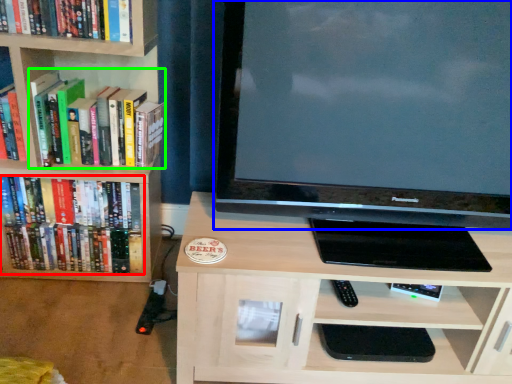
Question: Which object is positioned closest to book (highlighted by a red box)? Select from television (highlighted by a blue box) and book (highlighted by a green box).

Choices:
 (A) television
 (B) book

Answer: (B)